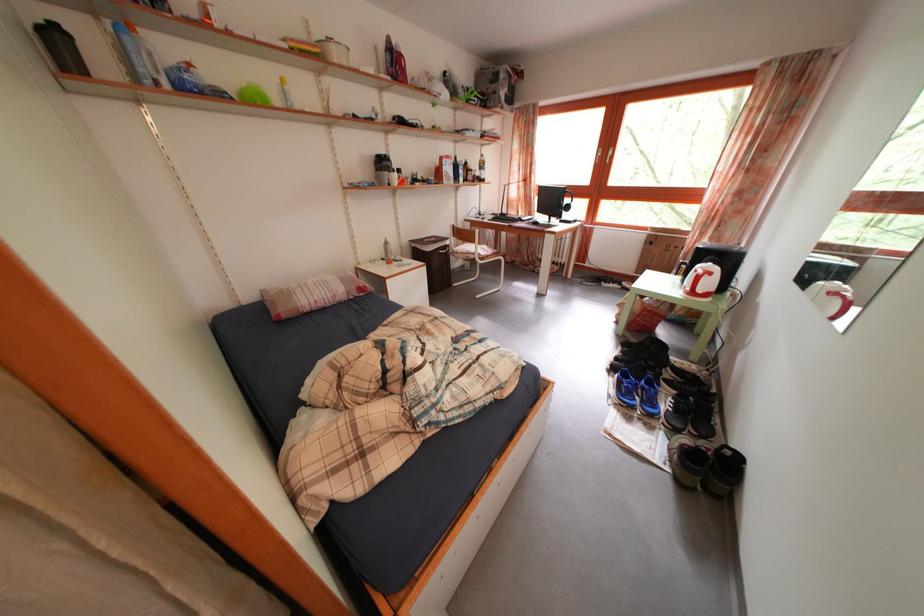
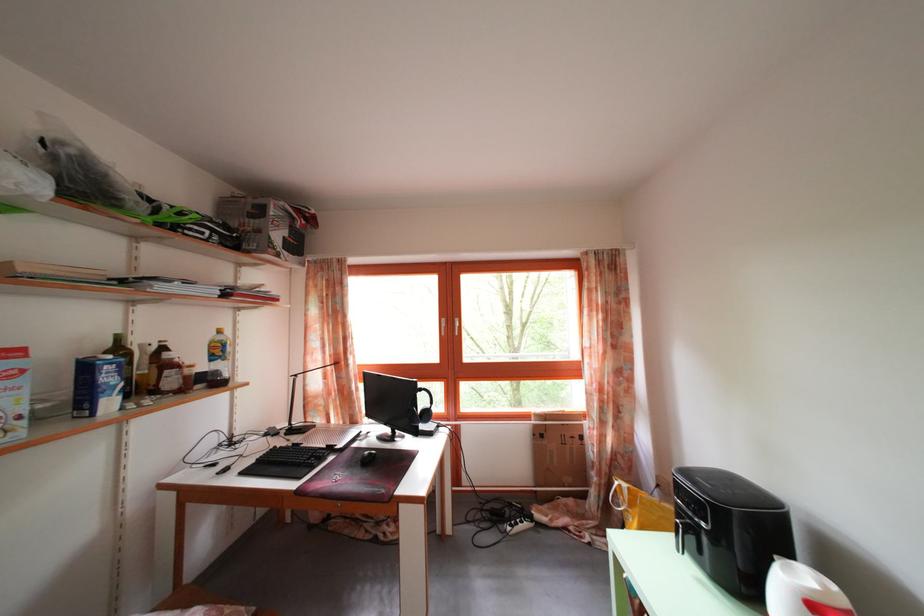
In the second image, find the point that corresponds to point (464, 164) in the first image.

(126, 346)